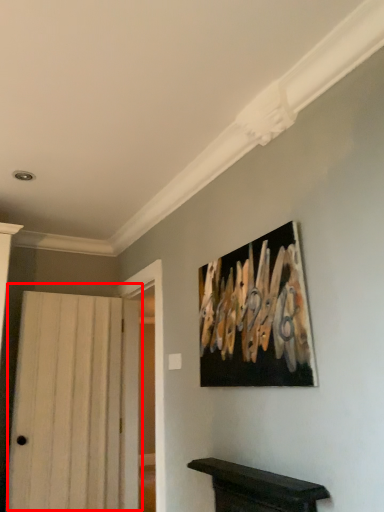
Question: From the image's perspective, where is door (annotated by the red box) located relative to picture frame?

Choices:
 (A) below
 (B) above

Answer: (A)